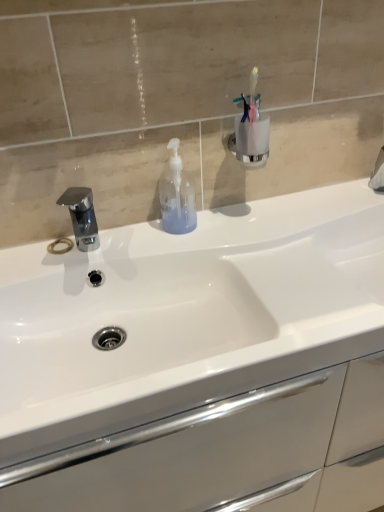
Find the location of a particular element. vacant space to the right of chrome metallic faucet at left is located at coordinates (164, 243).